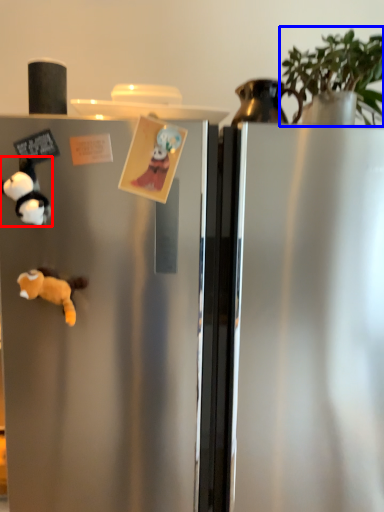
Question: Among these objects, which one is farthest to the camera, toy (highlighted by a red box) or plant (highlighted by a blue box)?

Choices:
 (A) toy
 (B) plant

Answer: (B)